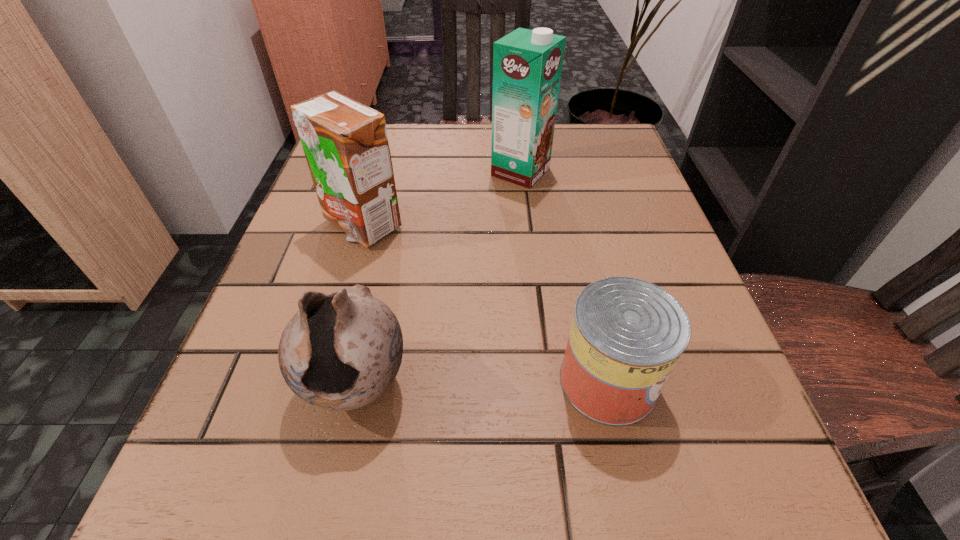
Identify the location of empty space between the shortest object and the shorter carton. This screenshot has width=960, height=540. (485, 303).

Where is `vacant area between the second shortest object and the shortest object`? The height and width of the screenshot is (540, 960). vacant area between the second shortest object and the shortest object is located at coordinates (x=482, y=383).

This screenshot has width=960, height=540. Identify the location of empty space between the tallest object and the third nearest object. (442, 198).

Locate an element on the screen. vacant space in between the shorter carton and the can is located at coordinates (485, 303).

This screenshot has height=540, width=960. I want to click on free spot between the second farthest object and the shortest object, so click(x=485, y=303).

This screenshot has height=540, width=960. I want to click on vacant area that lies between the shorter carton and the can, so 485,303.

Identify which object is the closest to the left carton. Please provide its 2D coordinates. Your answer should be formatted as a tuple, i.e. [(x, y)], where the tuple contains the x and y coordinates of a point satisfying the conditions above.

[(527, 64)]

Point out which object is positioned as the third nearest to the third tallest object. Please provide its 2D coordinates. Your answer should be formatted as a tuple, i.e. [(x, y)], where the tuple contains the x and y coordinates of a point satisfying the conditions above.

[(527, 64)]

Where is `free location that satisfies the following two spatial constraints: 1. on the straw side of the left carton; 2. on the right side of the can`? free location that satisfies the following two spatial constraints: 1. on the straw side of the left carton; 2. on the right side of the can is located at coordinates (316, 381).